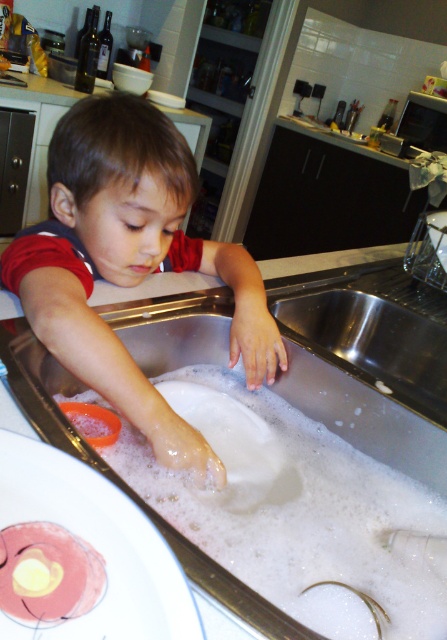
Which is above, stainless steel sink at lower center or smooth plastic bowl at center?

Positioned higher is smooth plastic bowl at center.

Who is taller, stainless steel sink at lower center or smooth plastic bowl at center?

Standing taller between the two is smooth plastic bowl at center.

The height and width of the screenshot is (640, 447). Describe the element at coordinates (369, 360) in the screenshot. I see `stainless steel sink at lower center` at that location.

Where is `stainless steel sink at lower center`? This screenshot has width=447, height=640. stainless steel sink at lower center is located at coordinates (369, 360).

Which is in front, point (144, 176) or point (256, 294)?

Point (144, 176)

Does point (178, 189) lie in front of point (279, 364)?

Yes, it is.

Describe the element at coordinates (110, 237) in the screenshot. I see `smooth plastic bowl at center` at that location.

Where is `smooth plastic bowl at center`? The image size is (447, 640). smooth plastic bowl at center is located at coordinates (110, 237).

Is point (199, 252) positioned after point (209, 470)?

That is True.

Is point (186, 164) in front of point (163, 449)?

That is False.

Locate an element on the screen. smooth plastic bowl at center is located at coordinates (110, 237).